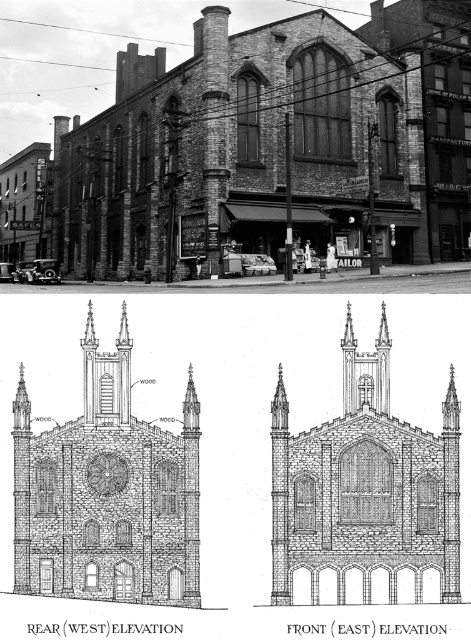
Question: Considering the relative positions of brick church at center and wooden church at center in the image provided, where is brick church at center located with respect to wooden church at center?

Choices:
 (A) below
 (B) above

Answer: (A)

Question: Which of the following is the farthest from the observer?

Choices:
 (A) brick church at center
 (B) wooden church at center

Answer: (A)

Question: Does brick church at center have a lesser width compared to wooden church at center?

Choices:
 (A) yes
 (B) no

Answer: (B)

Question: Does brick church at center appear over wooden church at center?

Choices:
 (A) no
 (B) yes

Answer: (A)